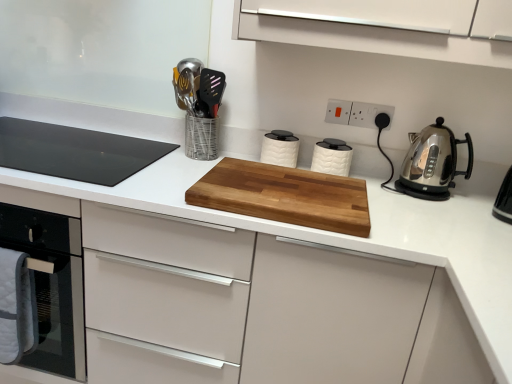
In order to face white plastic electrical outlet at upper center, positioned as the second electric outlet in left-to-right order, should I rotate leftwards or rightwards?

Turn right approximately 15.077 degrees to face it.

Looking at this image, what is the approximate width of white plastic electrical outlet at upper center, which ranks as the 1th electric outlet in right-to-left order?

1.65 centimeters.

Image resolution: width=512 pixels, height=384 pixels. In order to click on polished stainless steel kettle at right, positioned as the third kitchen appliance in left-to-right order in this screenshot , I will do `click(432, 163)`.

Image resolution: width=512 pixels, height=384 pixels. I want to click on natural wood cutting board at center, so click(284, 196).

Would you say white textured canister at center, the third kitchen appliance positioned from the right, is inside or outside white plastic electric outlet at upper center, the 2th electric outlet positioned from the right?

white textured canister at center, the third kitchen appliance positioned from the right, is not inside white plastic electric outlet at upper center, the 2th electric outlet positioned from the right, it's outside.

From a real-world perspective, which object rests below the other?

white textured canister at center, the first kitchen appliance in the left-to-right sequence, from a real-world perspective.

Is point (292, 165) in front of point (340, 120)?

Yes, point (292, 165) is in front of point (340, 120).

Consider the image. Considering the sizes of black glass cooktop at left and white textured canister at center, positioned as the second kitchen appliance in right-to-left order, in the image, is black glass cooktop at left wider or thinner than white textured canister at center, positioned as the second kitchen appliance in right-to-left order,?

Considering their sizes, black glass cooktop at left looks broader than white textured canister at center, positioned as the second kitchen appliance in right-to-left order.

Would you say black glass cooktop at left is a long distance from white textured canister at center, positioned as the second kitchen appliance in right-to-left order?

No.

Based on their positions, is black glass cooktop at left located to the left or right of white textured canister at center, the second kitchen appliance from the left?

Based on their positions, black glass cooktop at left is located to the left of white textured canister at center, the second kitchen appliance from the left.

From the black glass cooktop at left, count 2nd kitchen appliance to the right and point to it. Please provide its 2D coordinates.

[(332, 157)]

Can you confirm if polished stainless steel kettle at right, which is the first kitchen appliance from right to left, is thinner than white textured canister at center, the first kitchen appliance in the left-to-right sequence?

No.

Are polished stainless steel kettle at right, positioned as the third kitchen appliance in left-to-right order, and white textured canister at center, the third kitchen appliance positioned from the right, located far from each other?

Actually, polished stainless steel kettle at right, positioned as the third kitchen appliance in left-to-right order, and white textured canister at center, the third kitchen appliance positioned from the right, are a little close together.

Is point (435, 177) less distant than point (294, 140)?

That is True.

Looking at this image, from the image's perspective, is polished stainless steel kettle at right, positioned as the third kitchen appliance in left-to-right order, on white textured canister at center, the third kitchen appliance positioned from the right?

Incorrect, from the image's perspective, polished stainless steel kettle at right, positioned as the third kitchen appliance in left-to-right order, is lower than white textured canister at center, the third kitchen appliance positioned from the right.

Is white plastic electric outlet at upper center, arranged as the first electric outlet when viewed from the left, positioned with its back to polished stainless steel kettle at right, which is the first kitchen appliance from right to left?

white plastic electric outlet at upper center, arranged as the first electric outlet when viewed from the left, is not turned away from polished stainless steel kettle at right, which is the first kitchen appliance from right to left.

In the image, is white plastic electric outlet at upper center, arranged as the first electric outlet when viewed from the left, on the left side or the right side of polished stainless steel kettle at right, positioned as the third kitchen appliance in left-to-right order?

In the image, white plastic electric outlet at upper center, arranged as the first electric outlet when viewed from the left, appears on the left side of polished stainless steel kettle at right, positioned as the third kitchen appliance in left-to-right order.

Locate an element on the screen. The width and height of the screenshot is (512, 384). the 3rd kitchen appliance below when counting from the white plastic electric outlet at upper center, the 2th electric outlet positioned from the right (from the image's perspective) is located at coordinates (432, 163).

Which of these two, white plastic electric outlet at upper center, arranged as the first electric outlet when viewed from the left, or polished stainless steel kettle at right, positioned as the third kitchen appliance in left-to-right order, stands shorter?

white plastic electric outlet at upper center, arranged as the first electric outlet when viewed from the left, is shorter.

Is the depth of white textured canister at center, positioned as the second kitchen appliance in right-to-left order, less than that of natural wood cutting board at center?

No, white textured canister at center, positioned as the second kitchen appliance in right-to-left order, is further to the viewer.

From a real-world perspective, does white textured canister at center, the second kitchen appliance from the left, sit lower than natural wood cutting board at center?

No, from a real-world perspective, white textured canister at center, the second kitchen appliance from the left, is not under natural wood cutting board at center.

Based on the photo, is white textured canister at center, positioned as the second kitchen appliance in right-to-left order, looking in the opposite direction of natural wood cutting board at center?

No, white textured canister at center, positioned as the second kitchen appliance in right-to-left order, is not facing away from natural wood cutting board at center.

How many degrees apart are the facing directions of white textured canister at center, positioned as the second kitchen appliance in right-to-left order, and natural wood cutting board at center?

The angle between the facing direction of white textured canister at center, positioned as the second kitchen appliance in right-to-left order, and the facing direction of natural wood cutting board at center is 1.09 degrees.

From a real-world perspective, is white plastic electrical outlet at upper center, which ranks as the 1th electric outlet in right-to-left order, over white textured canister at center, the first kitchen appliance in the left-to-right sequence?

Yes, from a real-world perspective, white plastic electrical outlet at upper center, which ranks as the 1th electric outlet in right-to-left order, is above white textured canister at center, the first kitchen appliance in the left-to-right sequence.

Locate an element on the screen. Image resolution: width=512 pixels, height=384 pixels. the 2nd kitchen appliance counting from the left side of the white plastic electrical outlet at upper center, positioned as the second electric outlet in left-to-right order is located at coordinates (280, 148).

Consider the image. Considering the relative positions of white plastic electrical outlet at upper center, which ranks as the 1th electric outlet in right-to-left order, and white textured canister at center, the third kitchen appliance positioned from the right, in the image provided, is white plastic electrical outlet at upper center, which ranks as the 1th electric outlet in right-to-left order, to the right of white textured canister at center, the third kitchen appliance positioned from the right, from the viewer's perspective?

Yes, white plastic electrical outlet at upper center, which ranks as the 1th electric outlet in right-to-left order, is to the right of white textured canister at center, the third kitchen appliance positioned from the right.

Between white textured canister at center, the third kitchen appliance positioned from the right, and metallic silver utensil holder at upper center, which one has smaller size?

With smaller size is white textured canister at center, the third kitchen appliance positioned from the right.

How distant is white textured canister at center, the first kitchen appliance in the left-to-right sequence, from metallic silver utensil holder at upper center?

The distance of white textured canister at center, the first kitchen appliance in the left-to-right sequence, from metallic silver utensil holder at upper center is 10.54 inches.

In the image, is white textured canister at center, the first kitchen appliance in the left-to-right sequence, on the left side or the right side of metallic silver utensil holder at upper center?

From the image, it's evident that white textured canister at center, the first kitchen appliance in the left-to-right sequence, is to the right of metallic silver utensil holder at upper center.

In terms of height, does white textured canister at center, the first kitchen appliance in the left-to-right sequence, look taller or shorter compared to metallic silver utensil holder at upper center?

Considering their sizes, white textured canister at center, the first kitchen appliance in the left-to-right sequence, has less height than metallic silver utensil holder at upper center.

From a real-world perspective, count 2nd electric outlets upward from the white textured canister at center, the third kitchen appliance positioned from the right, and point to it. Please provide its 2D coordinates.

[(338, 111)]

At what (x,y) coordinates should I click in order to perform the action: click on the 2nd kitchen appliance to the right of the black glass cooktop at left, counting from the anchor's position. Please return your answer as a coordinate pair (x, y). This screenshot has height=384, width=512. Looking at the image, I should click on (332, 157).

From the image, which object appears to be nearer to metallic silver utensil holder at upper center, black glass cooktop at left or white plastic electrical outlet at upper center, positioned as the second electric outlet in left-to-right order?

Based on the image, black glass cooktop at left appears to be nearer to metallic silver utensil holder at upper center.

Consider the image. Looking at the image, which one is located closer to white plastic electrical outlet at upper center, positioned as the second electric outlet in left-to-right order, white plastic electric outlet at upper center, arranged as the first electric outlet when viewed from the left, or white textured canister at center, positioned as the second kitchen appliance in right-to-left order?

white plastic electric outlet at upper center, arranged as the first electric outlet when viewed from the left, is positioned closer to the anchor white plastic electrical outlet at upper center, positioned as the second electric outlet in left-to-right order.

From the image, which object appears to be farther from white plastic electrical outlet at upper center, which ranks as the 1th electric outlet in right-to-left order, white textured canister at center, the second kitchen appliance from the left, or white plastic electric outlet at upper center, arranged as the first electric outlet when viewed from the left?

The object further to white plastic electrical outlet at upper center, which ranks as the 1th electric outlet in right-to-left order, is white textured canister at center, the second kitchen appliance from the left.

Based on their spatial positions, is white textured canister at center, the second kitchen appliance from the left, or natural wood cutting board at center further from black glass cooktop at left?

white textured canister at center, the second kitchen appliance from the left, is further to black glass cooktop at left.

Which object lies further to the anchor point white textured canister at center, the second kitchen appliance from the left, natural wood cutting board at center or white textured canister at center, the third kitchen appliance positioned from the right?

The object further to white textured canister at center, the second kitchen appliance from the left, is natural wood cutting board at center.

Based on their spatial positions, is black glass cooktop at left or white textured canister at center, the first kitchen appliance in the left-to-right sequence, closer to polished stainless steel kettle at right, which is the first kitchen appliance from right to left?

white textured canister at center, the first kitchen appliance in the left-to-right sequence, is positioned closer to the anchor polished stainless steel kettle at right, which is the first kitchen appliance from right to left.

Which object lies nearer to the anchor point polished stainless steel kettle at right, which is the first kitchen appliance from right to left, white plastic electrical outlet at upper center, which ranks as the 1th electric outlet in right-to-left order, or white textured canister at center, the second kitchen appliance from the left?

Among the two, white plastic electrical outlet at upper center, which ranks as the 1th electric outlet in right-to-left order, is located nearer to polished stainless steel kettle at right, which is the first kitchen appliance from right to left.

Which object lies nearer to the anchor point black glass cooktop at left, white textured canister at center, positioned as the second kitchen appliance in right-to-left order, or white plastic electrical outlet at upper center, positioned as the second electric outlet in left-to-right order?

white textured canister at center, positioned as the second kitchen appliance in right-to-left order.

Where is `cutting board between metallic silver utensil holder at upper center and polished stainless steel kettle at right, which is the first kitchen appliance from right to left`? The width and height of the screenshot is (512, 384). cutting board between metallic silver utensil holder at upper center and polished stainless steel kettle at right, which is the first kitchen appliance from right to left is located at coordinates (284, 196).

You are a GUI agent. You are given a task and a screenshot of the screen. Output one action in this format:
    pyautogui.click(x=<x>, y=<y>)
    Task: Click on the appliance situated between black glass cooktop at left and white textured canister at center, the second kitchen appliance from the left, from left to right
    
    Given the screenshot: What is the action you would take?
    pyautogui.click(x=199, y=106)

Find the location of a particular element. Image resolution: width=512 pixels, height=384 pixels. cutting board between black glass cooktop at left and white plastic electrical outlet at upper center, positioned as the second electric outlet in left-to-right order, from left to right is located at coordinates (284, 196).

Find the location of `appliance between natural wood cutting board at center and white textured canister at center, the third kitchen appliance positioned from the right, along the z-axis`. appliance between natural wood cutting board at center and white textured canister at center, the third kitchen appliance positioned from the right, along the z-axis is located at coordinates (199, 106).